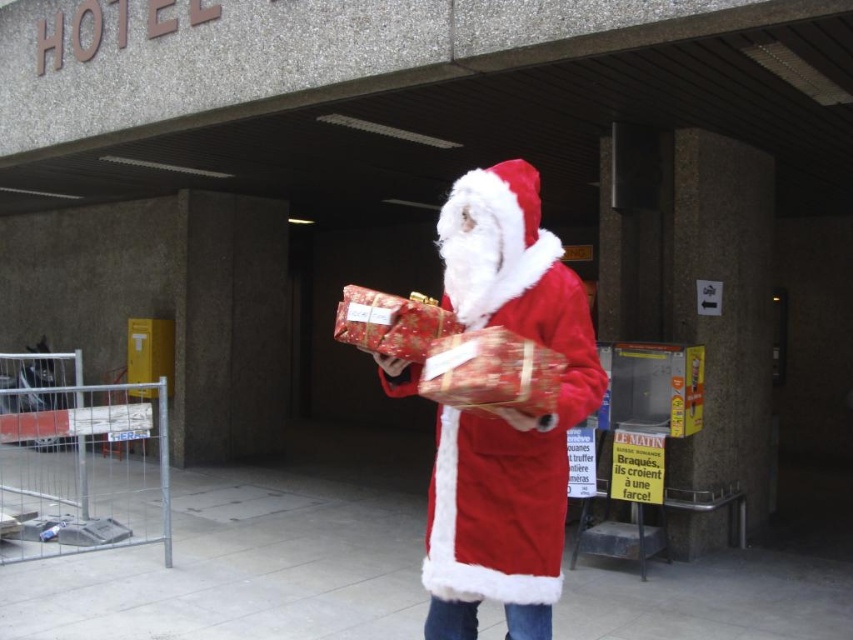
Who is taller, fuzzy red coat at center or shiny red wrapping paper at center?

fuzzy red coat at center is taller.

Does fuzzy red coat at center appear over shiny red wrapping paper at center?

Incorrect, fuzzy red coat at center is not positioned above shiny red wrapping paper at center.

Where is `fuzzy red coat at center`? The height and width of the screenshot is (640, 853). fuzzy red coat at center is located at coordinates (505, 413).

The image size is (853, 640). In order to click on fuzzy red coat at center in this screenshot , I will do `click(505, 413)`.